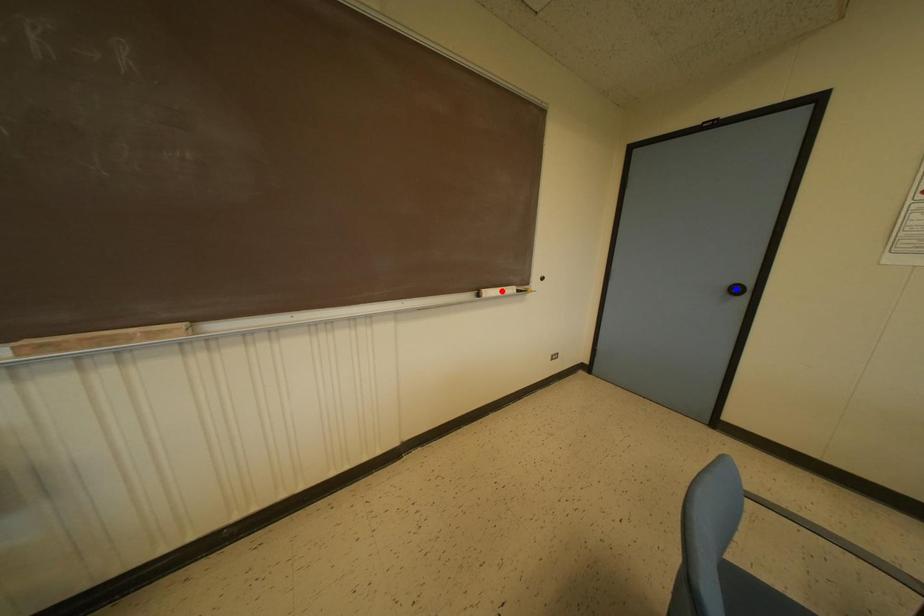
Question: In the image, two points are highlighted. Which point is nearer to the camera? Reply with the corresponding letter.

Choices:
 (A) blue point
 (B) red point

Answer: (B)